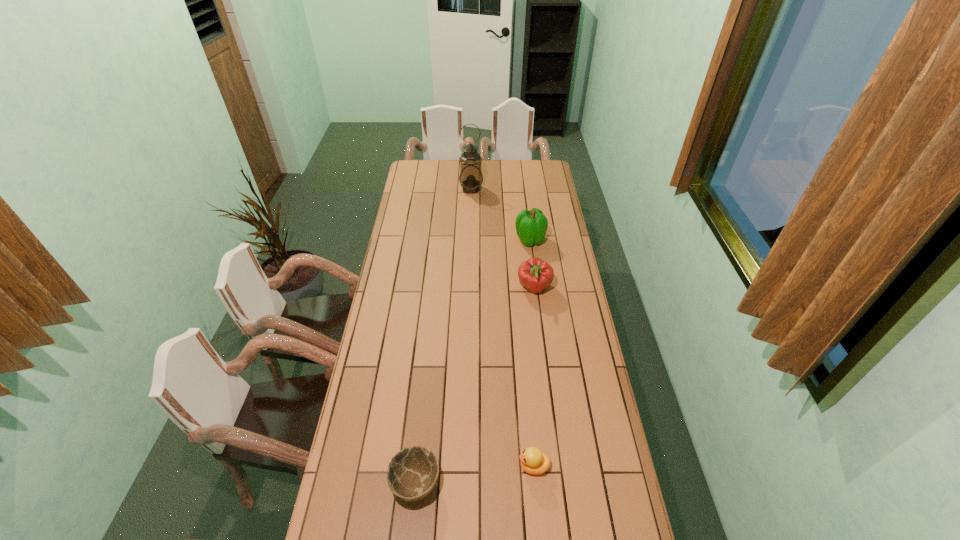
Where is `the second object from left to right`? The width and height of the screenshot is (960, 540). the second object from left to right is located at coordinates (470, 178).

Locate an element on the screen. the farthest object is located at coordinates (470, 178).

At what (x,y) coordinates should I click in order to perform the action: click on the fourth shortest object. Please return your answer as a coordinate pair (x, y). The image size is (960, 540). Looking at the image, I should click on (531, 226).

At what (x,y) coordinates should I click in order to perform the action: click on the farther bell pepper. Please return your answer as a coordinate pair (x, y). This screenshot has width=960, height=540. Looking at the image, I should click on [x=531, y=226].

Identify the location of the nearer bell pepper. (534, 274).

Identify the location of the shorter bell pepper. This screenshot has width=960, height=540. (534, 274).

Where is `duckling`? The height and width of the screenshot is (540, 960). duckling is located at coordinates (533, 461).

This screenshot has width=960, height=540. I want to click on the leftmost object, so click(412, 474).

Locate an element on the screen. The height and width of the screenshot is (540, 960). free space located on the front of the tallest object is located at coordinates (470, 228).

Find the location of a particular element. This screenshot has width=960, height=540. vacant area situated 0.390m on the left of the second tallest object is located at coordinates (435, 240).